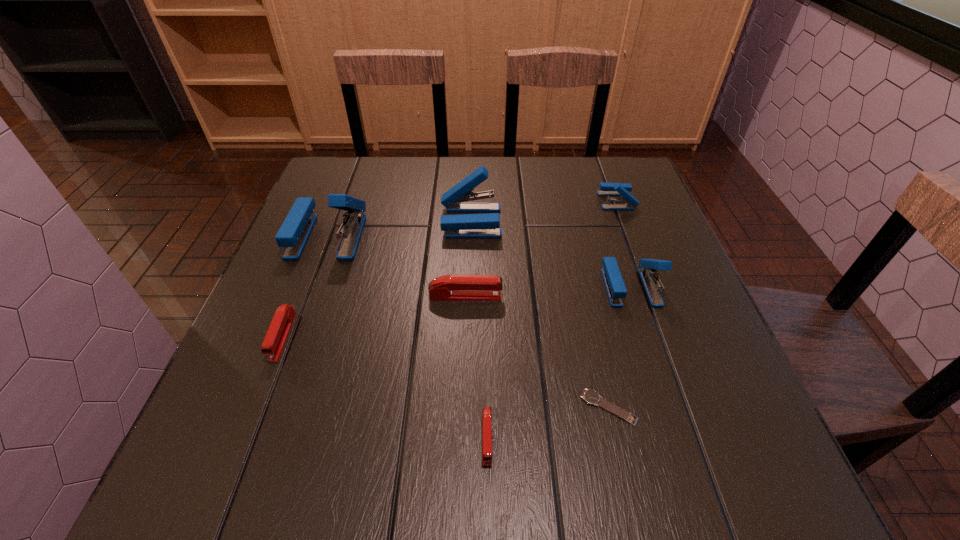
You are a GUI agent. You are given a task and a screenshot of the screen. Output one action in this format:
    pyautogui.click(x=<x>, y=<y>)
    Task: Click on the leftmost red stapler
    
    Given the screenshot: What is the action you would take?
    pyautogui.click(x=277, y=334)

Locate an element on the screen. This screenshot has height=540, width=960. the sixth tallest stapler is located at coordinates (277, 334).

In order to click on the nearest red stapler in this screenshot , I will do `click(486, 410)`.

The height and width of the screenshot is (540, 960). I want to click on the nearest stapler, so click(486, 410).

This screenshot has height=540, width=960. I want to click on watch, so click(591, 397).

You are a GUI agent. You are given a task and a screenshot of the screen. Output one action in this format:
    pyautogui.click(x=<x>, y=<y>)
    Task: Click on the sixth object from left to right
    
    Given the screenshot: What is the action you would take?
    pyautogui.click(x=591, y=397)

Find the location of `vacant space located 0.080m on the front of the biggest blue stapler`. vacant space located 0.080m on the front of the biggest blue stapler is located at coordinates coord(308,287).

Where is `blank area located 0.110m on the right of the second biggest blue stapler`? The image size is (960, 540). blank area located 0.110m on the right of the second biggest blue stapler is located at coordinates (545, 221).

Identify the location of free spot located on the back of the sixth shortest object. The image size is (960, 540). (592, 173).

This screenshot has width=960, height=540. Identify the location of vacant region located 0.150m on the front of the fourth tallest object. (635, 249).